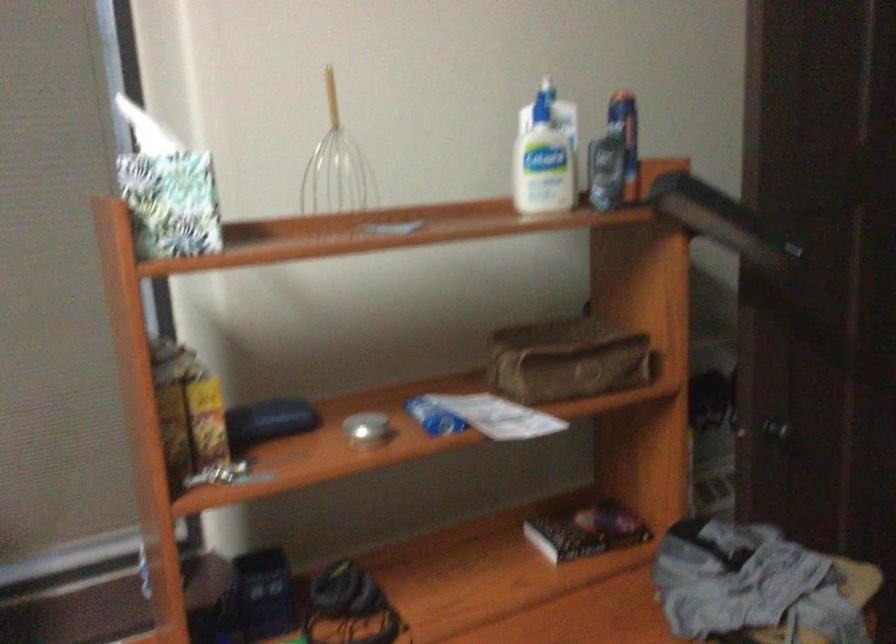
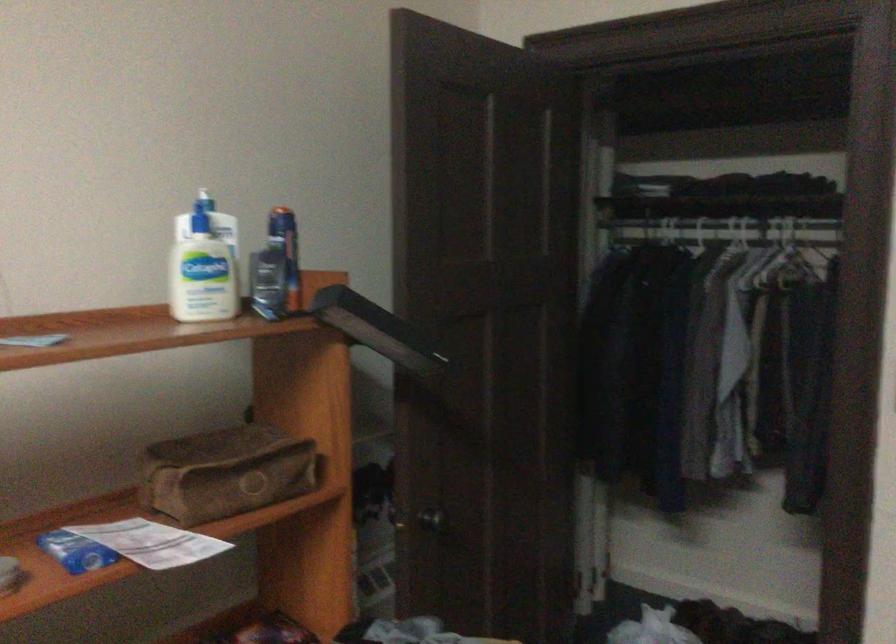
In the second image, find the point that corresponds to (x=563, y=359) in the first image.

(226, 471)